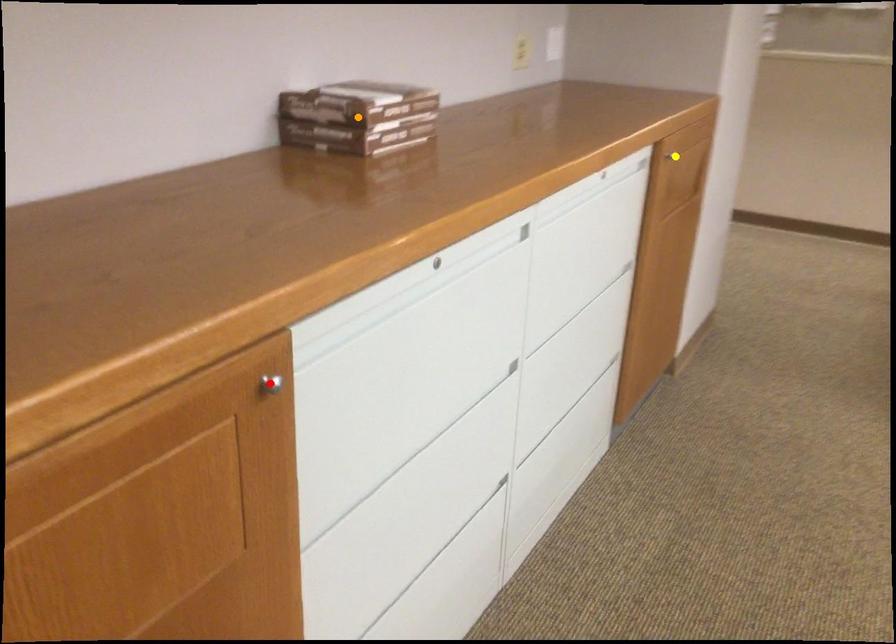
Order these from nearest to farthest:
red point | orange point | yellow point

red point
orange point
yellow point